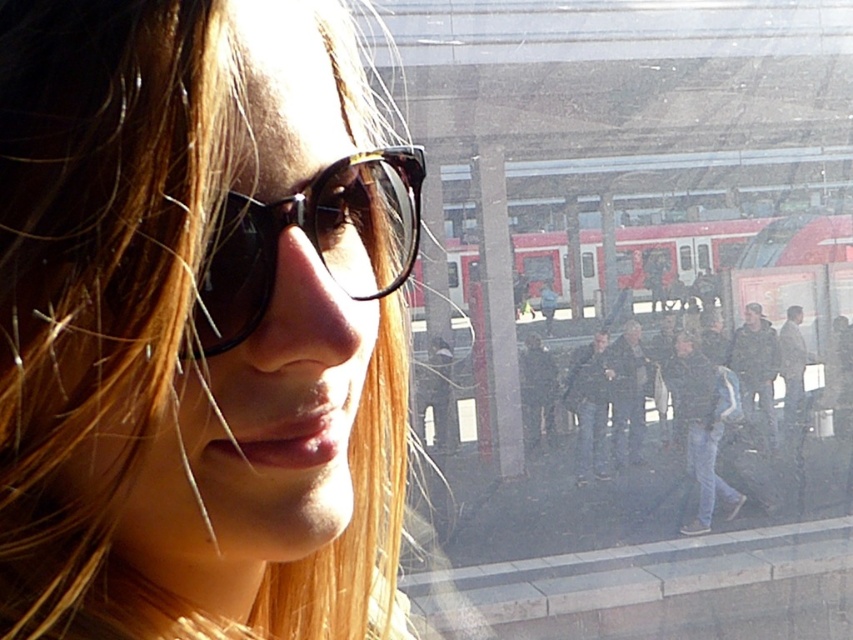
Question: Can you confirm if matte black sunglasses at center is positioned below dark gray fabric jacket at center?

Choices:
 (A) no
 (B) yes

Answer: (A)

Question: Estimate the real-world distances between objects in this image. Which object is closer to the matte black sunglasses at center?

Choices:
 (A) blue jeans at center
 (B) black leather jacket at center

Answer: (A)

Question: Which point is farther to the camera?

Choices:
 (A) blue jeans at center
 (B) dark gray fabric jacket at center
 (C) matte black sunglasses at center
 (D) black leather jacket at center

Answer: (B)

Question: Is black plastic sunglasses at center bigger than blue jeans at center?

Choices:
 (A) yes
 (B) no

Answer: (B)

Question: Is blue jeans at center smaller than black leather jacket at center?

Choices:
 (A) no
 (B) yes

Answer: (A)

Question: Which point is closer to the camera taking this photo?

Choices:
 (A) (225, 241)
 (B) (706, 435)
 (C) (593, 406)
 (D) (236, 524)

Answer: (A)